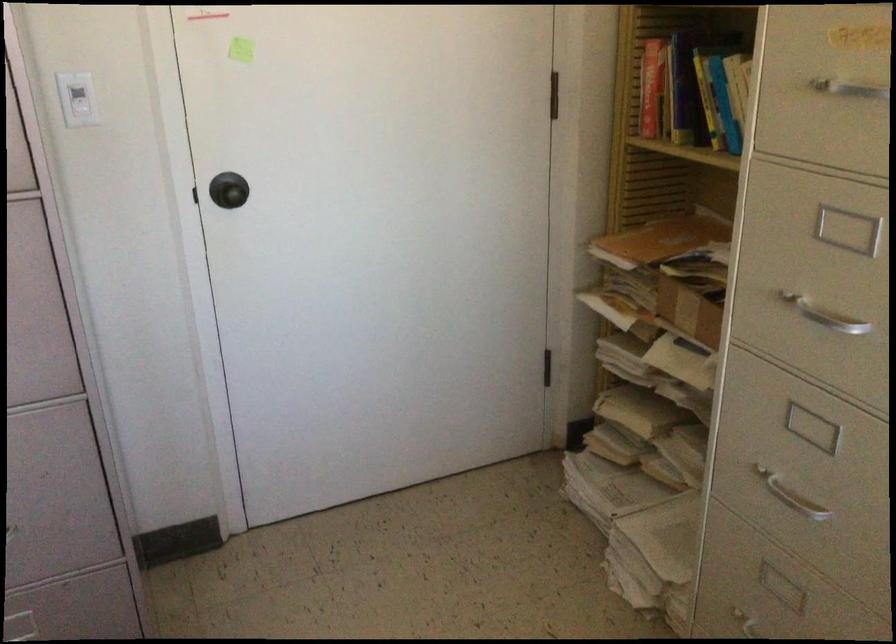
The location [688,310] corresponds to which object?

This point indicates the small cardboard box.